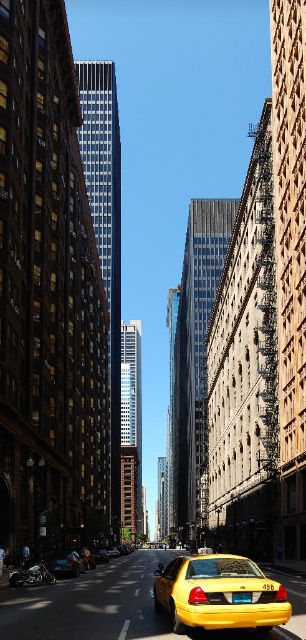
You are standing on the street looking up at the skyscrapers. There are two points marked on the ground in front of you. The first point is at coordinates point [101,561] and the second point is at point [109,550]. Which point is closer to you?

Point [101,561] is closer to you because it is in front of point [109,550].

You are standing at the point labeled point at (78, 556). You want to walk to the nearest building entrance. The nearest building entrance is 76.44 meters away from your current position. Is the nearest building entrance closer than 80 meters?

The nearest building entrance is 76.44 meters away from the point at (78, 556), so yes, it is closer than 80 meters.

You are a delivery person who needs to load a package onto the roof of either the shiny black car at lower left or the yellow matte taxi at center. Which vehicle should you choose to ensure the package can be placed securely on its roof without overhanging?

The yellow matte taxi at center is taller than the shiny black car at lower left, so you should choose the yellow matte taxi at center to place the package securely on its roof without overhanging.